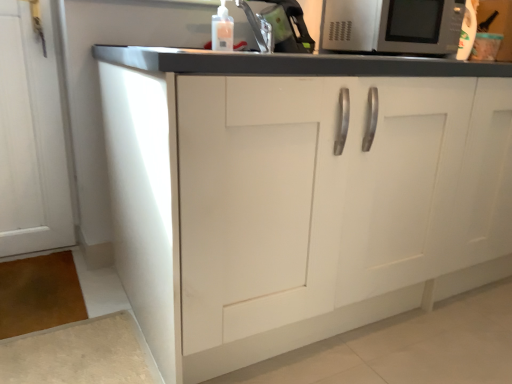
At what (x,y) coordinates should I click in order to perform the action: click on satin silver microwave at upper right. Please return your answer as a coordinate pair (x, y). This screenshot has width=512, height=384. Looking at the image, I should click on (392, 26).

At what (x,y) coordinates should I click in order to perform the action: click on translucent plastic bottle at upper center. Please return your answer as a coordinate pair (x, y). Looking at the image, I should click on (222, 29).

Locate an element on the screen. white matte cabinet at center is located at coordinates (296, 192).

Image resolution: width=512 pixels, height=384 pixels. Identify the location of transparent plastic sink at upper center. (285, 25).

Considering the relative positions of white matte cabinet at center and translucent plastic bottle at upper center in the image provided, is white matte cabinet at center to the left of translucent plastic bottle at upper center from the viewer's perspective?

In fact, white matte cabinet at center is to the right of translucent plastic bottle at upper center.

In terms of height, does white matte cabinet at center look taller or shorter compared to translucent plastic bottle at upper center?

Clearly, white matte cabinet at center is taller compared to translucent plastic bottle at upper center.

Can you confirm if white matte cabinet at center is wider than translucent plastic bottle at upper center?

Yes, white matte cabinet at center is wider than translucent plastic bottle at upper center.

In the scene shown: Does white matte cabinet at center have a smaller size compared to translucent plastic bottle at upper center?

Incorrect, white matte cabinet at center is not smaller in size than translucent plastic bottle at upper center.

Which object is positioned more to the left, translucent plastic bottle at upper center or transparent plastic sink at upper center?

translucent plastic bottle at upper center is more to the left.

At what (x,y) coordinates should I click in order to perform the action: click on bottle below the transparent plastic sink at upper center (from the image's perspective). Please return your answer as a coordinate pair (x, y). Looking at the image, I should click on (222, 29).

Is translucent plastic bottle at upper center positioned with its back to transparent plastic sink at upper center?

Yes, translucent plastic bottle at upper center is positioned with its back facing transparent plastic sink at upper center.

Considering the relative sizes of translucent plastic bottle at upper center and transparent plastic sink at upper center in the image provided, is translucent plastic bottle at upper center taller than transparent plastic sink at upper center?

No.

Is the surface of satin silver microwave at upper right in direct contact with transparent plastic sink at upper center?

No, satin silver microwave at upper right is not making contact with transparent plastic sink at upper center.

Is satin silver microwave at upper right positioned with its back to transparent plastic sink at upper center?

No, satin silver microwave at upper right is not facing the opposite direction of transparent plastic sink at upper center.

Looking at this image, from a real-world perspective, which is physically above, satin silver microwave at upper right or transparent plastic sink at upper center?

satin silver microwave at upper right is physically above.

From the image's perspective, is satin silver microwave at upper right located above or below transparent plastic sink at upper center?

satin silver microwave at upper right is above transparent plastic sink at upper center.

Which point is more distant from viewer, (x=220, y=31) or (x=477, y=77)?

Positioned behind is point (x=220, y=31).

Looking at their sizes, would you say translucent plastic bottle at upper center is wider or thinner than white matte cabinet at center?

In the image, translucent plastic bottle at upper center appears to be more narrow than white matte cabinet at center.

Does translucent plastic bottle at upper center have a larger size compared to white matte cabinet at center?

No, translucent plastic bottle at upper center is not bigger than white matte cabinet at center.

What's the angular difference between transparent plastic sink at upper center and white matte cabinet at center's facing directions?

1.26 degrees.

Considering the positions of objects transparent plastic sink at upper center and white matte cabinet at center in the image provided, who is more to the right, transparent plastic sink at upper center or white matte cabinet at center?

From the viewer's perspective, white matte cabinet at center appears more on the right side.

Would you consider transparent plastic sink at upper center to be distant from white matte cabinet at center?

No, there isn't a large distance between transparent plastic sink at upper center and white matte cabinet at center.

From the image's perspective, is transparent plastic sink at upper center on white matte cabinet at center?

Yes, from the image's perspective, transparent plastic sink at upper center is over white matte cabinet at center.

Would you consider satin silver microwave at upper right to be distant from translucent plastic bottle at upper center?

Actually, satin silver microwave at upper right and translucent plastic bottle at upper center are a little close together.

In the image, is satin silver microwave at upper right on the left side or the right side of translucent plastic bottle at upper center?

satin silver microwave at upper right is to the right of translucent plastic bottle at upper center.

Considering the sizes of objects satin silver microwave at upper right and translucent plastic bottle at upper center in the image provided, who is thinner, satin silver microwave at upper right or translucent plastic bottle at upper center?

translucent plastic bottle at upper center is thinner.

Is satin silver microwave at upper right smaller than translucent plastic bottle at upper center?

Incorrect, satin silver microwave at upper right is not smaller in size than translucent plastic bottle at upper center.

Identify the location of microwave oven located behind the translucent plastic bottle at upper center. (392, 26).

Is point (214, 27) less distant than point (338, 47)?

Yes, point (214, 27) is closer to viewer.

From the image's perspective, which is above, translucent plastic bottle at upper center or satin silver microwave at upper right?

From the image's view, satin silver microwave at upper right is above.

Is translucent plastic bottle at upper center thinner than satin silver microwave at upper right?

Indeed, translucent plastic bottle at upper center has a lesser width compared to satin silver microwave at upper right.

Find the location of a particular element. cabinetry below the translucent plastic bottle at upper center (from a real-world perspective) is located at coordinates (296, 192).

Find the location of a particular element. bottle lying below the transparent plastic sink at upper center (from the image's perspective) is located at coordinates (222, 29).

When comparing their distances from white matte cabinet at center, does satin silver microwave at upper right or transparent plastic sink at upper center seem further?

satin silver microwave at upper right lies further to white matte cabinet at center than the other object.

Based on their spatial positions, is white matte cabinet at center or translucent plastic bottle at upper center closer to transparent plastic sink at upper center?

translucent plastic bottle at upper center lies closer to transparent plastic sink at upper center than the other object.

Looking at the image, which one is located further to translucent plastic bottle at upper center, transparent plastic sink at upper center or satin silver microwave at upper right?

Based on the image, satin silver microwave at upper right appears to be further to translucent plastic bottle at upper center.

Looking at the image, which one is located closer to satin silver microwave at upper right, white matte cabinet at center or translucent plastic bottle at upper center?

translucent plastic bottle at upper center lies closer to satin silver microwave at upper right than the other object.

Considering their positions, is transparent plastic sink at upper center positioned further to satin silver microwave at upper right than translucent plastic bottle at upper center?

translucent plastic bottle at upper center lies further to satin silver microwave at upper right than the other object.

Based on their spatial positions, is translucent plastic bottle at upper center or satin silver microwave at upper right closer to white matte cabinet at center?

Among the two, translucent plastic bottle at upper center is located nearer to white matte cabinet at center.

Based on the photo, from the image, which object appears to be nearer to satin silver microwave at upper right, transparent plastic sink at upper center or white matte cabinet at center?

transparent plastic sink at upper center is closer to satin silver microwave at upper right.

Looking at this image, from the image, which object appears to be farther from translucent plastic bottle at upper center, transparent plastic sink at upper center or white matte cabinet at center?

Answer: Among the two, white matte cabinet at center is located further to translucent plastic bottle at upper center.

Locate an element on the screen. The image size is (512, 384). sink between translucent plastic bottle at upper center and satin silver microwave at upper right in the horizontal direction is located at coordinates (285, 25).

Where is `sink between white matte cabinet at center and satin silver microwave at upper right along the z-axis`? This screenshot has height=384, width=512. sink between white matte cabinet at center and satin silver microwave at upper right along the z-axis is located at coordinates (285, 25).

Where is `microwave oven between translucent plastic bottle at upper center and white matte cabinet at center`? The height and width of the screenshot is (384, 512). microwave oven between translucent plastic bottle at upper center and white matte cabinet at center is located at coordinates (392, 26).

At what (x,y) coordinates should I click in order to perform the action: click on sink between translucent plastic bottle at upper center and white matte cabinet at center in the horizontal direction. Please return your answer as a coordinate pair (x, y). The height and width of the screenshot is (384, 512). Looking at the image, I should click on (285, 25).